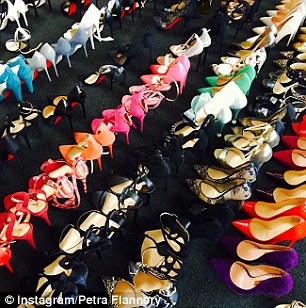
Where is `carpet`? This screenshot has height=308, width=306. carpet is located at coordinates (197, 296).